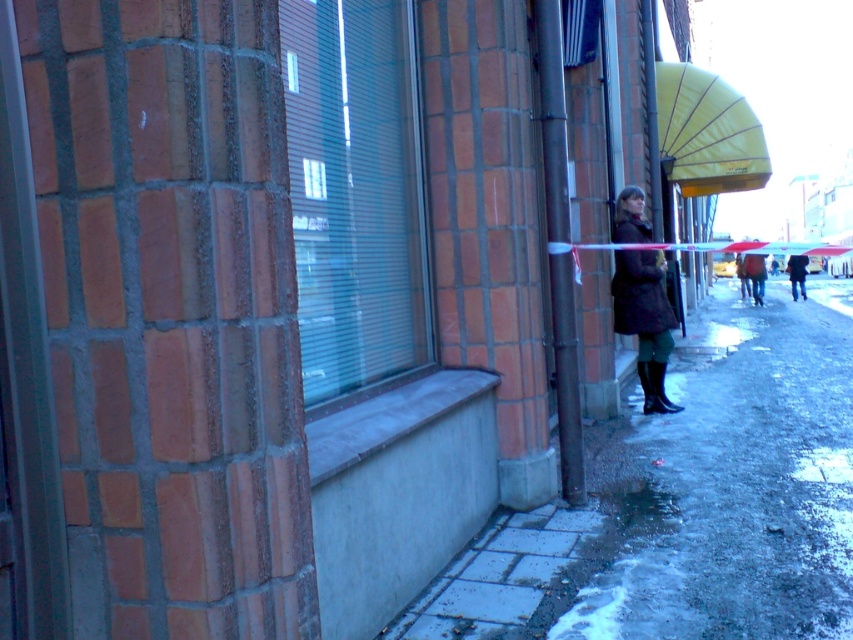
Question: Which point is closer to the camera?

Choices:
 (A) yellow fabric umbrella at upper right
 (B) dark brown leather coat at right
 (C) dark brown leather jacket at center

Answer: (B)

Question: Does transparent glass window at center come behind transparent glass window at upper center?

Choices:
 (A) yes
 (B) no

Answer: (B)

Question: Can you confirm if transparent glass window at center is wider than dark brown leather jacket at center?

Choices:
 (A) yes
 (B) no

Answer: (B)

Question: Is yellow fabric umbrella at upper right below transparent glass window at upper center?

Choices:
 (A) yes
 (B) no

Answer: (B)

Question: Among these points, which one is nearest to the camera?

Choices:
 (A) (416, 252)
 (B) (753, 164)

Answer: (A)

Question: Which of the following is the closest to the observer?

Choices:
 (A) (305, 221)
 (B) (733, 248)
 (C) (792, 276)

Answer: (A)